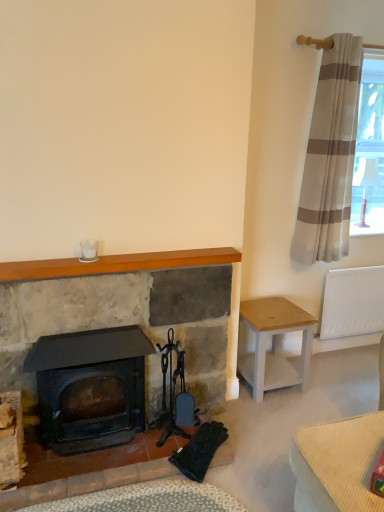
Locate an element on the screen. This screenshot has height=512, width=384. empty space that is ontop of white wood stool at right is located at coordinates (270, 311).